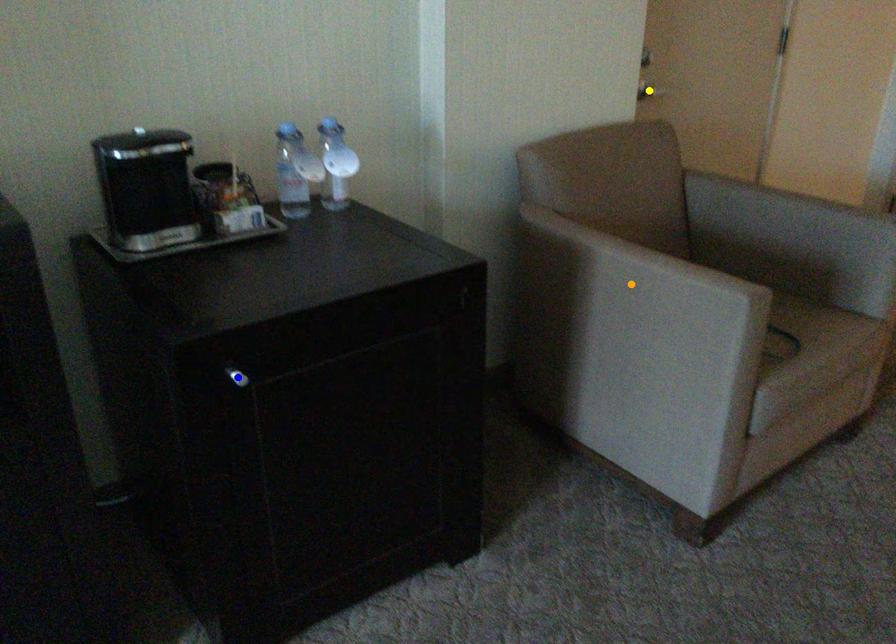
Order these from farthest to nearest:
1. orange point
2. blue point
3. yellow point

yellow point < orange point < blue point